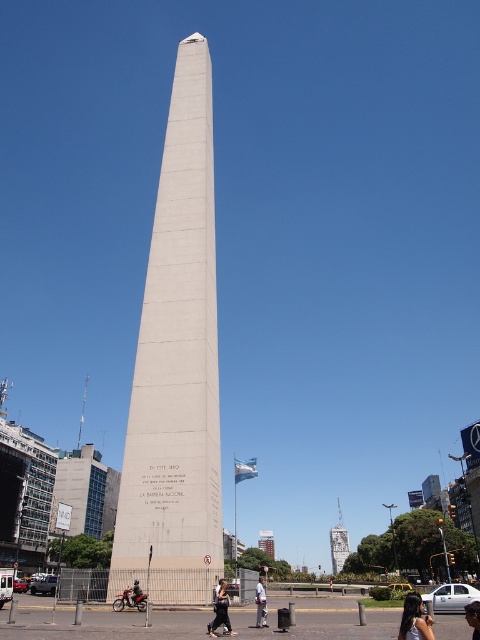
You are a photographer trying to capture a photo of the white concrete tower at center. However, there is a person with dark brown hair at lower right in the frame. Based on their height, will the person block the view of the tower?

The dark brown hair at lower right is not as tall as the white concrete tower at center, so the person will not block the view of the tower.